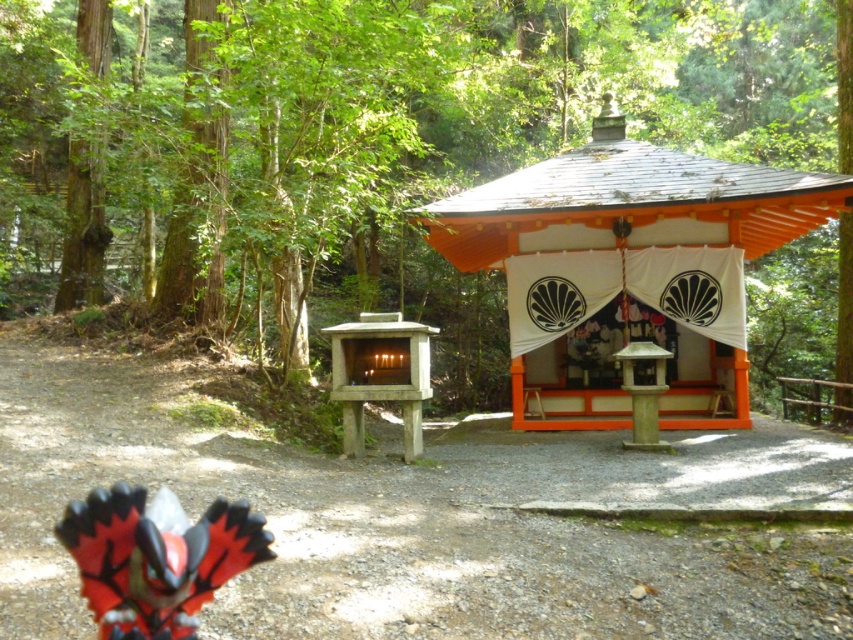
Identify the location of green wood tree at upper left. This screenshot has height=640, width=853. (479, 132).

Does point (119, 237) lie in front of point (352, 340)?

No, it is behind (352, 340).

Which is behind, point (331, 289) or point (358, 454)?

Positioned behind is point (331, 289).

Find the location of a particular element. The height and width of the screenshot is (640, 853). green wood tree at upper left is located at coordinates (479, 132).

Can you confirm if orange wood gazebo at center is thinner than smooth concrete shrine at center?

Correct, orange wood gazebo at center's width is less than smooth concrete shrine at center's.

In the scene shown: Which of these two, orange wood gazebo at center or smooth concrete shrine at center, stands taller?

With more height is smooth concrete shrine at center.

Consider the image. Who is more forward, (734, 184) or (363, 324)?

Point (363, 324) is in front.

At what (x,y) coordinates should I click in order to perform the action: click on orange wood gazebo at center. Please return your answer as a coordinate pair (x, y). Looking at the image, I should click on (625, 262).

Which is in front, point (227, 272) or point (746, 449)?

Point (746, 449)

Image resolution: width=853 pixels, height=640 pixels. Describe the element at coordinates (479, 132) in the screenshot. I see `green wood tree at upper left` at that location.

Identify the location of green wood tree at upper left. (479, 132).